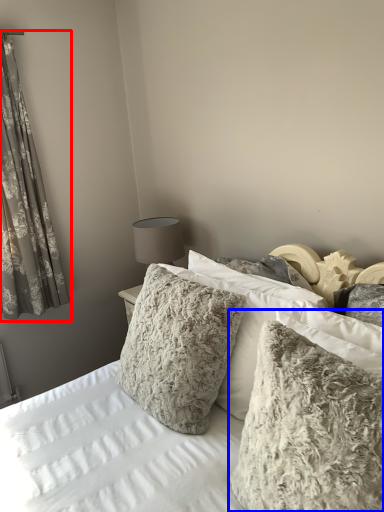
Question: Which point is further to the camera, curtain (highlighted by a red box) or pillow (highlighted by a blue box)?

Choices:
 (A) curtain
 (B) pillow

Answer: (A)